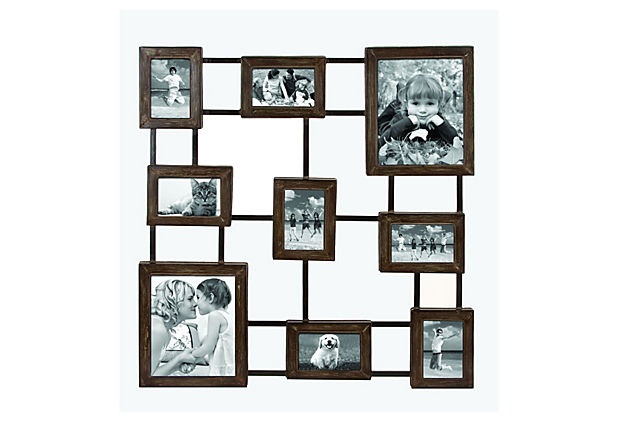
Where is `picture frames`? picture frames is located at coordinates (170, 50), (281, 60), (421, 53), (431, 217), (309, 183), (193, 172), (193, 268), (337, 327), (446, 313).